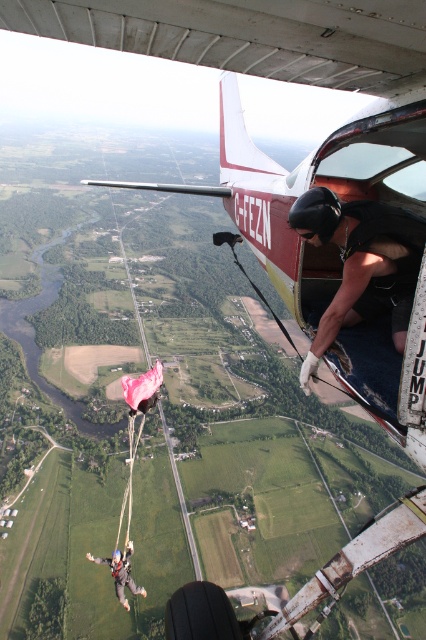
In the scene shown: You are a skydiving instructor observing the scene from the plane. You notice the black matte helmet at upper center and the gray fabric parachute at lower left. Which object is positioned higher in the sky?

The black matte helmet at upper center is positioned higher in the sky than the gray fabric parachute at lower left.

You are a skydiving instructor observing the scene from the plane. You notice the black matte helmet at upper center and the gray fabric parachute at lower left. Which object appears smaller in height when viewed from your position inside the aircraft?

The black matte helmet at upper center has a lesser height compared to the gray fabric parachute at lower left, so it appears smaller in height when viewed from inside the aircraft.

You are a skydiving instructor observing the scene from the aircraft. You notice the black matte helmet at upper center and the gray fabric parachute at lower left. Which object is closer to you, the instructor, in this perspective?

The black matte helmet at upper center is closer to you because it is positioned in front of the gray fabric parachute at lower left.